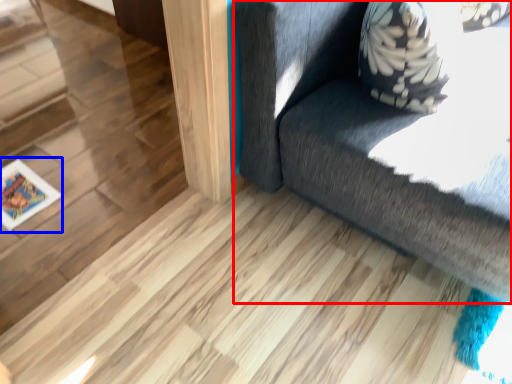
Question: Which object is closer to the camera taking this photo, furniture (highlighted by a red box) or picture frame (highlighted by a blue box)?

Choices:
 (A) furniture
 (B) picture frame

Answer: (A)